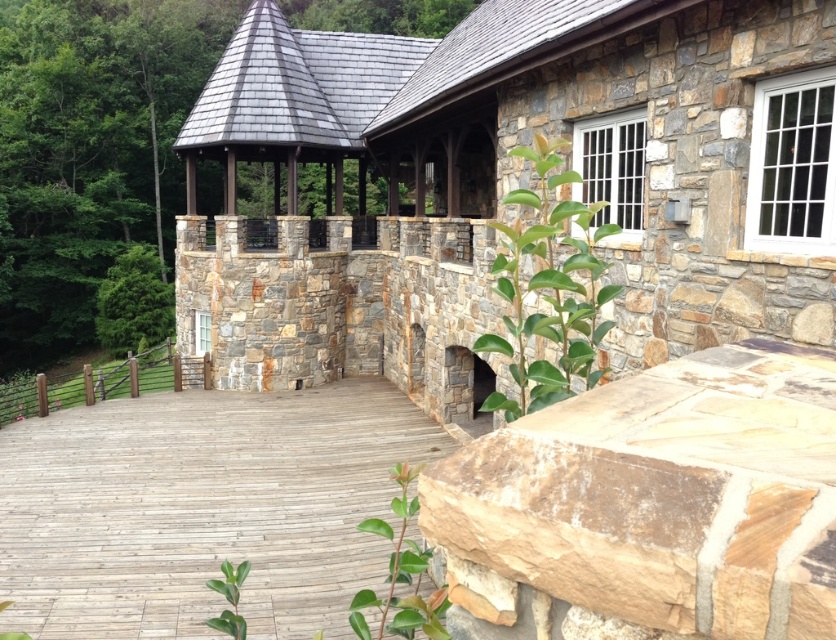
Which is behind, point (724, 259) or point (261, 445)?

The point (261, 445) is more distant.

This screenshot has height=640, width=836. What do you see at coordinates (513, 182) in the screenshot?
I see `natural stone gazebo at center` at bounding box center [513, 182].

Locate an element on the screen. The height and width of the screenshot is (640, 836). natural stone gazebo at center is located at coordinates (513, 182).

Can you confirm if natural stone gazebo at center is positioned to the right of natural stone wall at center?

In fact, natural stone gazebo at center is to the left of natural stone wall at center.

The height and width of the screenshot is (640, 836). Describe the element at coordinates (513, 182) in the screenshot. I see `natural stone gazebo at center` at that location.

Who is more distant from viewer, (405, 179) or (720, 600)?

The point (405, 179) is more distant.

You are a GUI agent. You are given a task and a screenshot of the screen. Output one action in this format:
    pyautogui.click(x=<x>, y=<y>)
    Task: Click on the natural stone gazebo at center
    Image resolution: width=836 pixels, height=640 pixels.
    Given the screenshot: What is the action you would take?
    pyautogui.click(x=513, y=182)

Does natural stone wall at center have a greater width compared to wooden deck at center?

No, natural stone wall at center is not wider than wooden deck at center.

Can you confirm if natural stone wall at center is positioned to the right of wooden deck at center?

Indeed, natural stone wall at center is positioned on the right side of wooden deck at center.

Is point (666, 461) closer to viewer compared to point (42, 432)?

Yes, it is in front of point (42, 432).

Where is `natural stone wall at center`? The image size is (836, 640). natural stone wall at center is located at coordinates (651, 506).